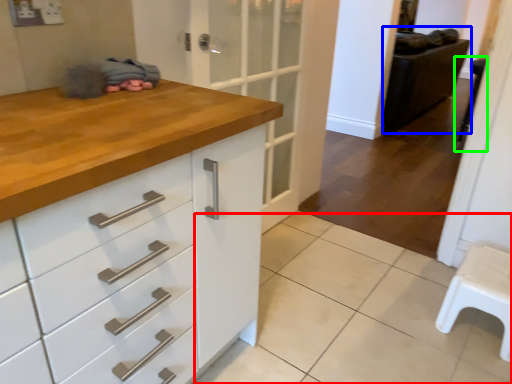
Question: Which object is the closest to the tile (highlighted by a red box)? Choose among these: chair (highlighted by a blue box) or step stool (highlighted by a green box).

Choices:
 (A) chair
 (B) step stool

Answer: (B)